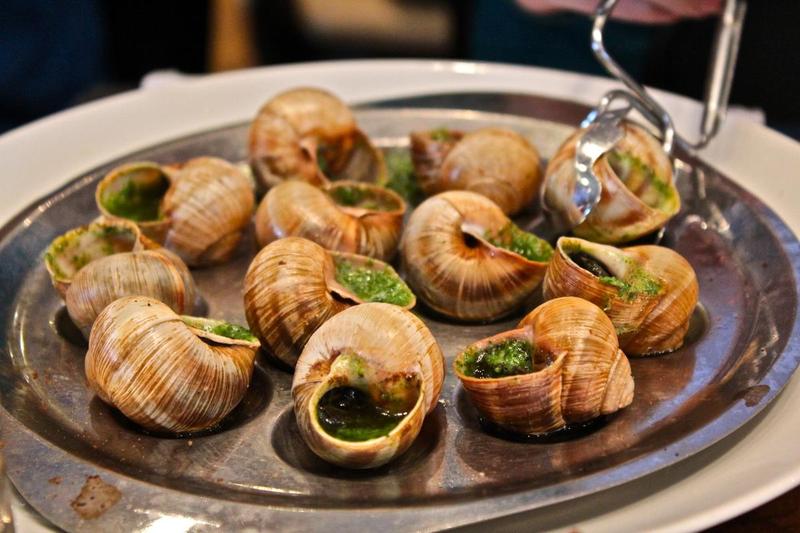
You are a GUI agent. You are given a task and a screenshot of the screen. Output one action in this format:
    pyautogui.click(x=<x>, y=<y>)
    Task: Click on the serving tray
    The height and width of the screenshot is (533, 800).
    Given the screenshot: What is the action you would take?
    pyautogui.click(x=741, y=142)